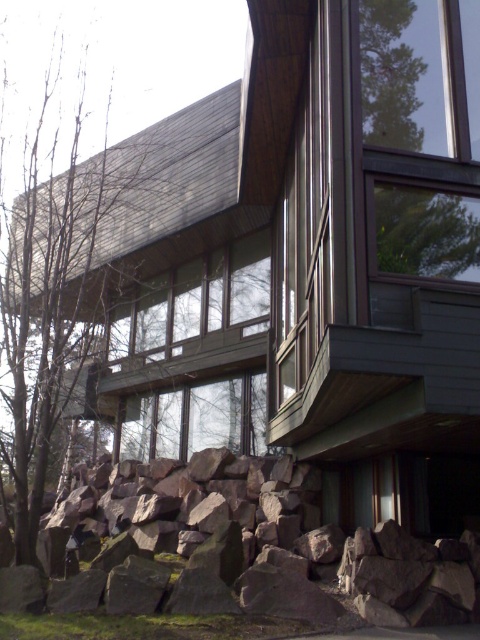
You are standing in front of the building and want to place a small potted plant between the brown rough rock at lower left and the bare branches at left. Which object should you place the plant closer to to ensure it fits within the available space?

The brown rough rock at lower left occupies less space than the bare branches at left, so you should place the plant closer to the brown rough rock at lower left to ensure it fits within the available space.

Looking at this image, you are standing in front of the building and notice the brown rough rock at lower left and the bare branches at left. From your perspective, which object is positioned more to the left?

The bare branches at left are positioned more to the left compared to the brown rough rock at lower left.